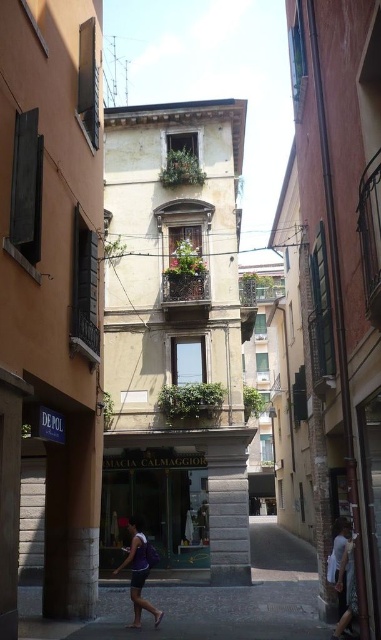
You are a tourist in this European city and you see the white cotton shirt at lower right and the purple fabric at center. Which one is positioned more to the east if the street runs from north to south?

The white cotton shirt at lower right is positioned more to the east because it is to the right of the purple fabric at center, and since the street runs north to south, right would correspond to the east direction.

You are standing on the street and see two points marked on the ground. The first point is at coordinates point (x=348, y=568) and the second is at point (x=132, y=554). Which point is closer to you as you face the buildings?

Point (x=348, y=568) is in front of point (x=132, y=554), so it is closer to you as you face the buildings.